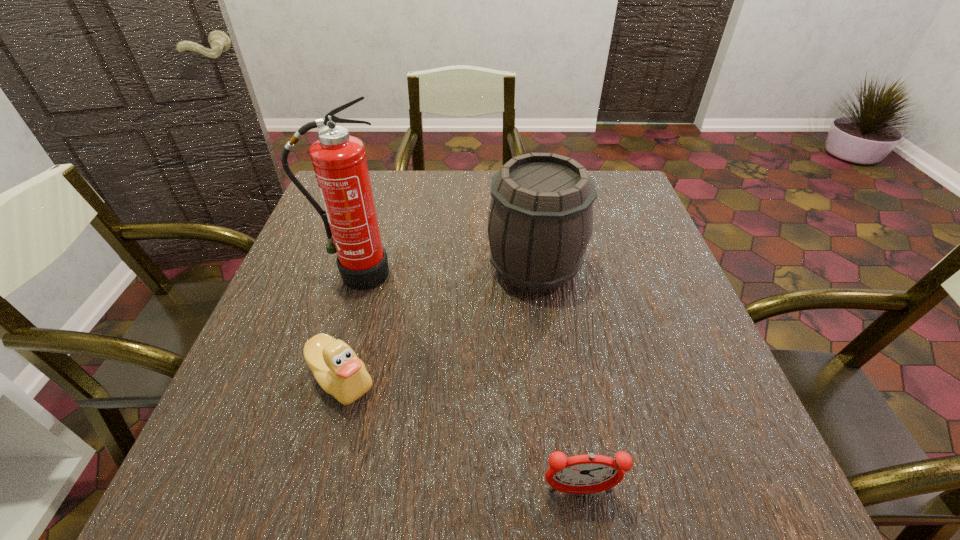
You are a GUI agent. You are given a task and a screenshot of the screen. Output one action in this format:
    pyautogui.click(x=<x>, y=<y>)
    Task: Click on the vacant space that's between the fire extinguisher and the alarm clock
    The width and height of the screenshot is (960, 540).
    Given the screenshot: What is the action you would take?
    pyautogui.click(x=468, y=383)

Identify the location of vacant space that is in between the second nearest object and the alarm clock. (461, 436).

Where is `free spot between the fire extinguisher and the nearest object`? This screenshot has height=540, width=960. free spot between the fire extinguisher and the nearest object is located at coordinates (468, 383).

Find the location of a particular element. Image resolution: width=960 pixels, height=540 pixels. blank region between the duck and the second tallest object is located at coordinates (438, 323).

Where is `free space between the fire extinguisher and the duck`? The image size is (960, 540). free space between the fire extinguisher and the duck is located at coordinates (349, 327).

The width and height of the screenshot is (960, 540). I want to click on vacant space in between the third shortest object and the fire extinguisher, so click(445, 270).

Identify the location of object that stands as the closest to the nearest object. (337, 369).

Identify which object is located as the second nearest to the third farthest object. Please provide its 2D coordinates. Your answer should be formatted as a tuple, i.e. [(x, y)], where the tuple contains the x and y coordinates of a point satisfying the conditions above.

[(540, 221)]